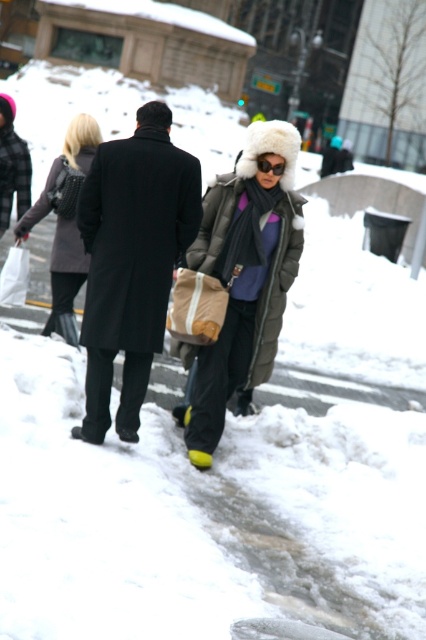
Based on the photo, between black wool coat at center and matte green puffer coat at center, which one appears on the left side from the viewer's perspective?

Positioned to the left is black wool coat at center.

Find the location of `black wool coat at center`. black wool coat at center is located at coordinates [132, 260].

Between black wool coat at center and matte black coat at upper left, which one has more height?

black wool coat at center

Between point (129, 240) and point (48, 330), which one is positioned behind?

Point (48, 330)

Does point (106, 221) lie in front of point (74, 260)?

Yes, point (106, 221) is in front of point (74, 260).

Locate an element on the screen. The height and width of the screenshot is (640, 426). black wool coat at center is located at coordinates (132, 260).

Does black wool coat at center lie in front of black matte sunglasses at center?

Yes, it is in front of black matte sunglasses at center.

Can you confirm if black wool coat at center is positioned above black matte sunglasses at center?

No, black wool coat at center is not above black matte sunglasses at center.

The height and width of the screenshot is (640, 426). In order to click on black wool coat at center in this screenshot , I will do `click(132, 260)`.